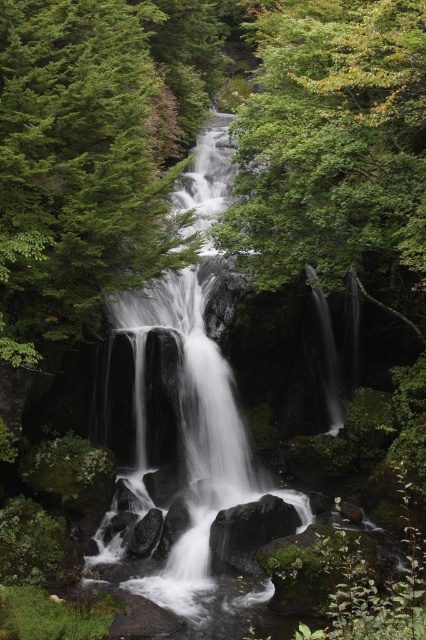
Question: Does green matte tree at center come behind green leafy tree at upper center?

Choices:
 (A) no
 (B) yes

Answer: (B)

Question: Is the position of green matte tree at center more distant than that of green leafy tree at upper center?

Choices:
 (A) no
 (B) yes

Answer: (B)

Question: Which object is closer to the camera taking this photo?

Choices:
 (A) green leafy tree at upper center
 (B) green matte tree at center

Answer: (A)

Question: Does green matte tree at center appear on the right side of green leafy tree at upper center?

Choices:
 (A) yes
 (B) no

Answer: (B)

Question: Which object appears farthest from the camera in this image?

Choices:
 (A) green matte tree at center
 (B) green leafy tree at upper center

Answer: (A)